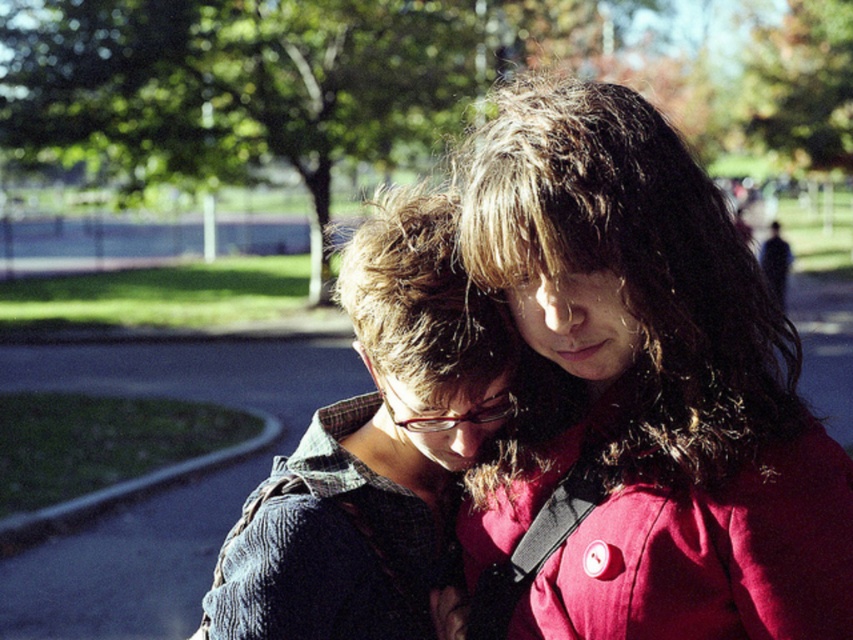
Question: Does matte blue sweater at center appear over denim jacket at center?

Choices:
 (A) yes
 (B) no

Answer: (A)

Question: Among these points, which one is nearest to the camera?

Choices:
 (A) (296, 620)
 (B) (740, 410)

Answer: (B)

Question: Can you confirm if matte blue sweater at center is bigger than denim jacket at center?

Choices:
 (A) yes
 (B) no

Answer: (A)

Question: Which object appears closest to the camera in this image?

Choices:
 (A) matte blue sweater at center
 (B) denim jacket at center

Answer: (A)

Question: Can you confirm if matte blue sweater at center is positioned above denim jacket at center?

Choices:
 (A) no
 (B) yes

Answer: (B)